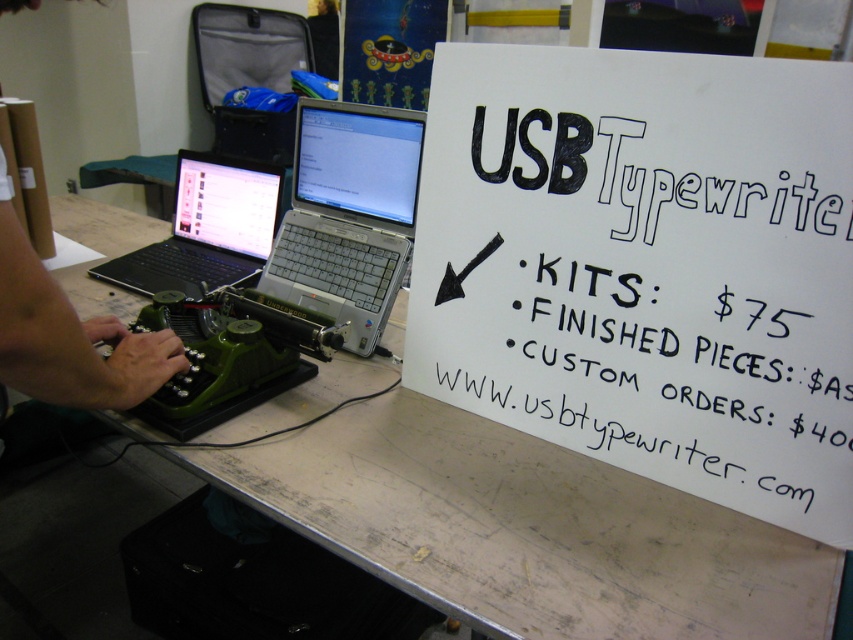
Consider the image. You are a customer looking to read the white paper sign at upper right and the satin black laptop at center. Since you want to read both, which object do you think you can read more comfortably from your current position?

The white paper sign at upper right has a larger width than the satin black laptop at center, so it might be easier to read the white paper sign at upper right from a distance.

You are a customer standing in front of the workspace. You want to read the prices listed on the white paper sign at upper right. Can you comfortably read the prices from your current position?

The white paper sign at upper right is 29.54 inches away from the viewer, so yes, you can comfortably read the prices from your current position since this distance is typical for reading signs.

You are a customer at a pop up shop and see the white paper sign at upper right and the green plastic typewriter at left. Which item is located more to the right side of the table?

The white paper sign at upper right is located more to the right side of the table than the green plastic typewriter at left.